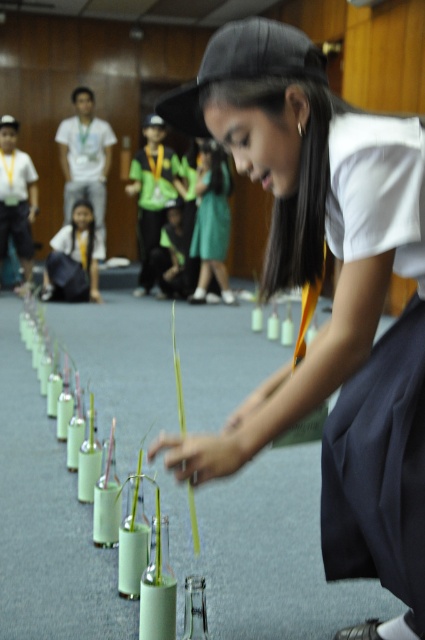
Between green fabric dress at center and matte black backpack at center, which one is positioned lower?

matte black backpack at center is lower down.

Does point (229, 208) come in front of point (67, 269)?

That is False.

Is point (203, 294) closer to viewer compared to point (99, 292)?

Yes, point (203, 294) is closer to viewer.

You are a GUI agent. You are given a task and a screenshot of the screen. Output one action in this format:
    pyautogui.click(x=<x>, y=<y>)
    Task: Click on the green fabric dress at center
    The height and width of the screenshot is (640, 425).
    Given the screenshot: What is the action you would take?
    pyautogui.click(x=212, y=221)

Is white matte uniform at center bigger than matte black backpack at center?

Correct, white matte uniform at center is larger in size than matte black backpack at center.

Does white matte uniform at center have a lesser height compared to matte black backpack at center?

No.

Is point (416, 529) positioned in front of point (53, 257)?

Yes, point (416, 529) is in front of point (53, 257).

Identify the location of white matte uniform at center. (333, 300).

Is point (410, 419) farther from viewer compared to point (221, 195)?

No, it is in front of (221, 195).

Between white matte uniform at center and green fabric dress at center, which one is positioned higher?

Positioned higher is green fabric dress at center.

Does point (340, 198) lie behind point (212, 204)?

That is False.

Locate an element on the screen. white matte uniform at center is located at coordinates point(333,300).